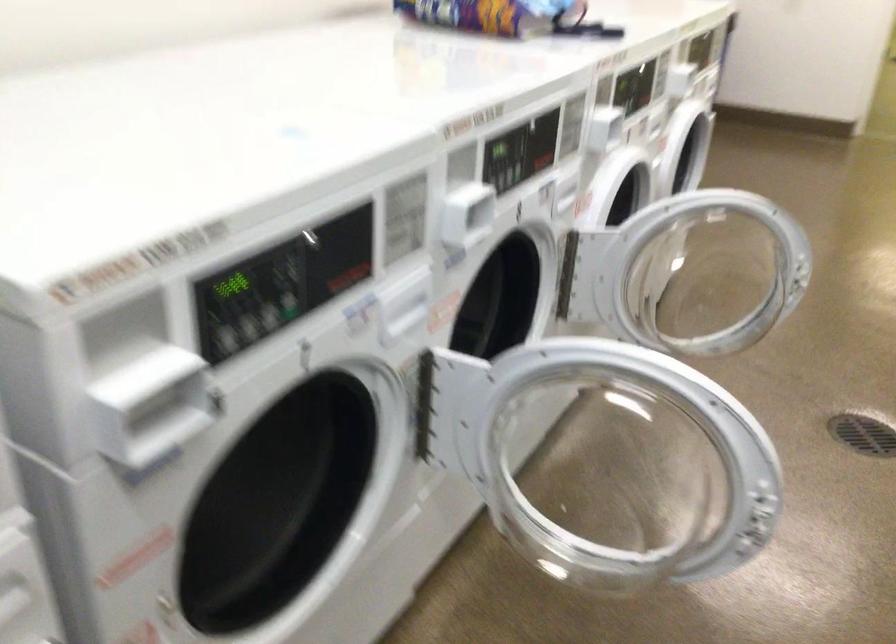
Question: The camera is either moving clockwise (left) or counter-clockwise (right) around the object. The first image is from the beginning of the video and the second image is from the end. Is the camera moving left or right when shooting the video?

Choices:
 (A) Left
 (B) Right

Answer: (B)